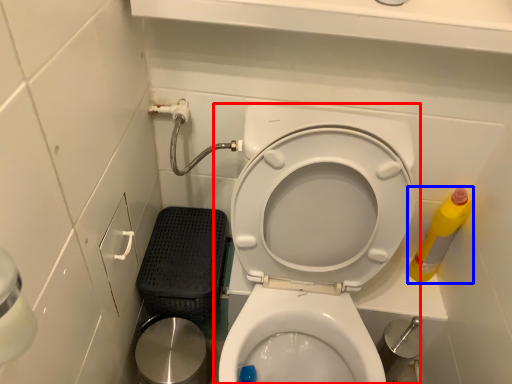
Question: Which object is closer to the camera taking this photo, toilet (highlighted by a red box) or cleaning product (highlighted by a blue box)?

Choices:
 (A) toilet
 (B) cleaning product

Answer: (A)